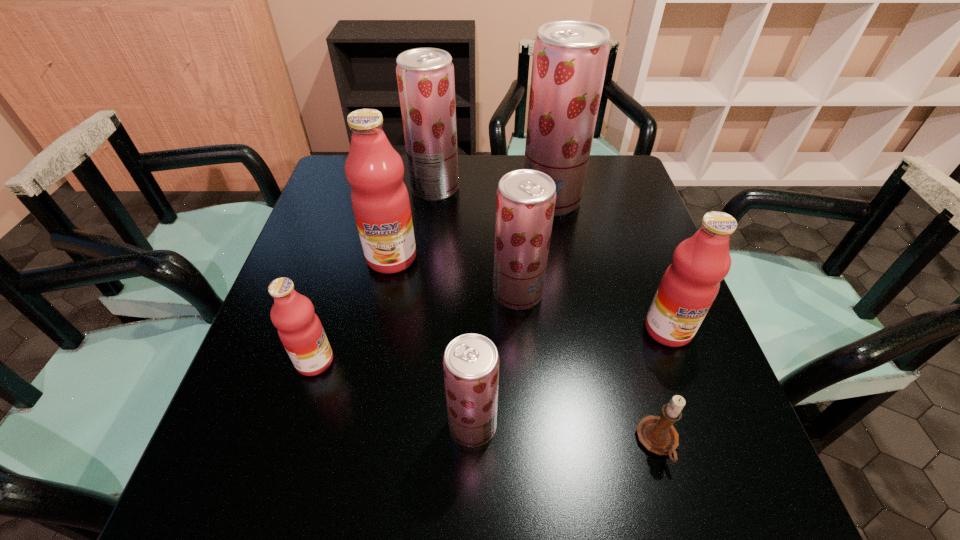
Locate an element on the screen. This screenshot has height=540, width=960. object at the near edge is located at coordinates (657, 434).

Locate an element on the screen. object that is at the left edge is located at coordinates (300, 330).

Find the location of a particular element. This screenshot has width=960, height=540. fruit juice at the right edge is located at coordinates pos(689,286).

The width and height of the screenshot is (960, 540). Identify the location of candle holder at the right edge. (657, 434).

Where is `object that is at the near right corner`? object that is at the near right corner is located at coordinates (657, 434).

The width and height of the screenshot is (960, 540). I want to click on vacant space at the far edge, so click(x=515, y=158).

What are the coordinates of `vacant space at the near edge of the desktop` in the screenshot? It's located at (416, 488).

The width and height of the screenshot is (960, 540). I want to click on vacant space at the left edge, so click(324, 200).

Identify the location of vacant space at the right edge of the desktop. The width and height of the screenshot is (960, 540). (660, 262).

Identify the location of vacant space at the far left corner of the desktop. (340, 186).